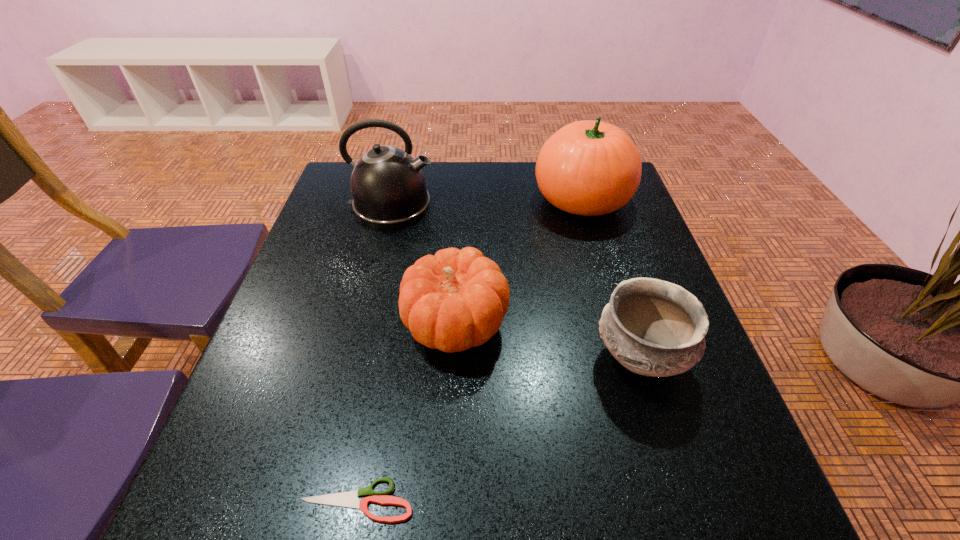
Identify the location of vacant area that lies between the pottery and the taller pumpkin. (612, 279).

This screenshot has width=960, height=540. In order to click on free spot between the pottery and the nearest object in this screenshot , I will do `click(498, 429)`.

Where is `free space between the kettle and the farther pumpkin`? The image size is (960, 540). free space between the kettle and the farther pumpkin is located at coordinates (487, 202).

Locate an element on the screen. The height and width of the screenshot is (540, 960). empty space that is in between the nearer pumpkin and the pottery is located at coordinates (548, 341).

What are the coordinates of `vacant area between the pottery and the right pumpkin` in the screenshot? It's located at 612,279.

Locate an element on the screen. vacant area that lies between the kettle and the scissors is located at coordinates (374, 354).

At what (x,y) coordinates should I click in order to perform the action: click on vacant area that lies between the pottery and the kettle. Please return your answer as a coordinate pair (x, y). This screenshot has width=960, height=540. Looking at the image, I should click on (516, 282).

At what (x,y) coordinates should I click in order to perform the action: click on unoccupied area between the kettle and the pottery. Please return your answer as a coordinate pair (x, y). Looking at the image, I should click on (516, 282).

I want to click on object that stands as the second closest to the pottery, so click(x=590, y=168).

Where is `object that stands as the third closest to the shorter pumpkin`? Image resolution: width=960 pixels, height=540 pixels. object that stands as the third closest to the shorter pumpkin is located at coordinates [388, 187].